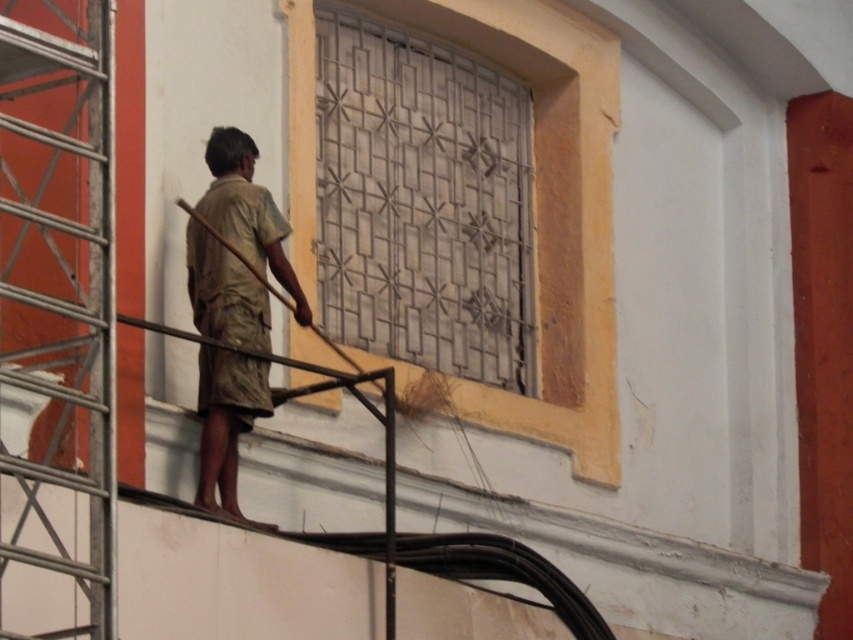
Is metallic grid at center wider than brown cotton shirt at center?

Indeed, metallic grid at center has a greater width compared to brown cotton shirt at center.

Is metallic grid at center shorter than brown cotton shirt at center?

Incorrect, metallic grid at center's height does not fall short of brown cotton shirt at center's.

Is point (585, 397) more distant than point (193, 307)?

Yes, point (585, 397) is farther from viewer.

Find the location of a particular element. The width and height of the screenshot is (853, 640). metallic grid at center is located at coordinates (552, 214).

Which of these two, metallic scaffolding at left or brown cotton shirt at center, stands taller?

With more height is metallic scaffolding at left.

The width and height of the screenshot is (853, 640). Describe the element at coordinates (56, 321) in the screenshot. I see `metallic scaffolding at left` at that location.

The width and height of the screenshot is (853, 640). What are the coordinates of `metallic scaffolding at left` in the screenshot? It's located at (56, 321).

This screenshot has height=640, width=853. I want to click on metallic scaffolding at left, so click(x=56, y=321).

From the picture: Can you confirm if metallic scaffolding at left is positioned above metallic grid at center?

Incorrect, metallic scaffolding at left is not positioned above metallic grid at center.

Can you confirm if metallic scaffolding at left is shorter than metallic grid at center?

Correct, metallic scaffolding at left is not as tall as metallic grid at center.

This screenshot has height=640, width=853. What are the coordinates of `metallic scaffolding at left` in the screenshot? It's located at (56, 321).